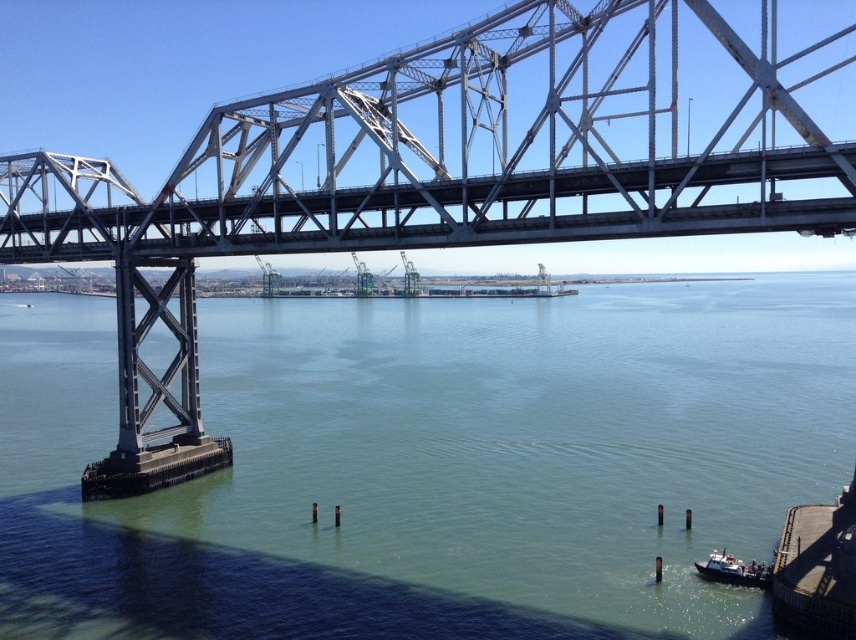
Question: Based on their relative distances, which object is nearer to the white plastic boat at lower right?

Choices:
 (A) green water at lower center
 (B) smooth concrete dock at lower right

Answer: (B)

Question: Observing the image, what is the correct spatial positioning of green water at lower center in reference to white plastic boat at lower right?

Choices:
 (A) below
 (B) above

Answer: (B)

Question: Can you confirm if smooth concrete dock at lower right is positioned below white plastic boat at lower right?

Choices:
 (A) yes
 (B) no

Answer: (B)

Question: Which object is the closest to the smooth concrete dock at lower right?

Choices:
 (A) white plastic boat at lower right
 (B) green water at lower center

Answer: (A)

Question: Which object is positioned closest to the smooth concrete dock at lower right?

Choices:
 (A) green water at lower center
 (B) white plastic boat at lower right

Answer: (B)

Question: Can you confirm if green water at lower center is bigger than white plastic boat at lower right?

Choices:
 (A) yes
 (B) no

Answer: (A)